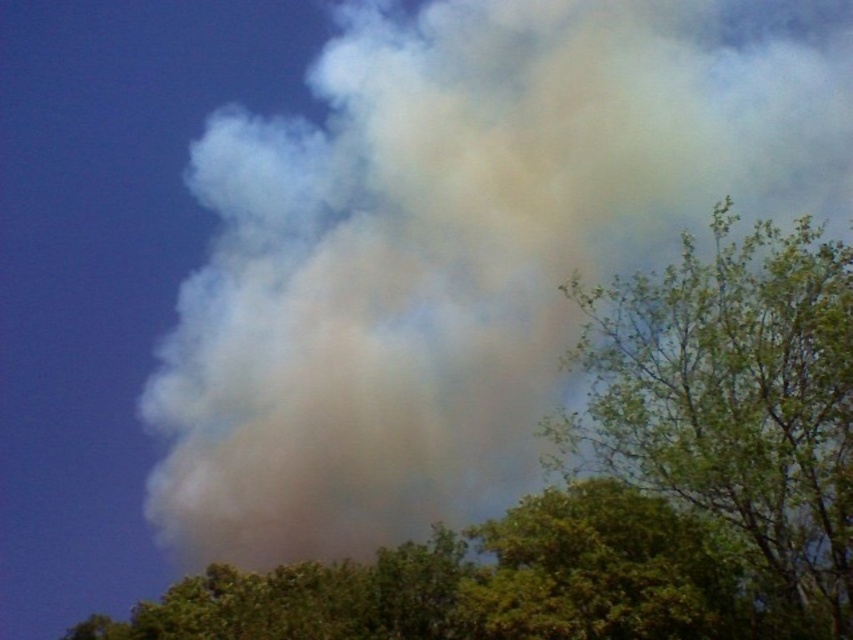
Question: Which object appears closest to the camera in this image?

Choices:
 (A) green leafy tree at lower center
 (B) green leafy tree at upper right

Answer: (A)

Question: Is green leafy tree at upper right bigger than green leafy tree at lower center?

Choices:
 (A) no
 (B) yes

Answer: (A)

Question: Is green leafy tree at upper right bigger than green leafy tree at lower center?

Choices:
 (A) yes
 (B) no

Answer: (B)

Question: Does green leafy tree at upper right lie behind green leafy tree at lower center?

Choices:
 (A) no
 (B) yes

Answer: (B)